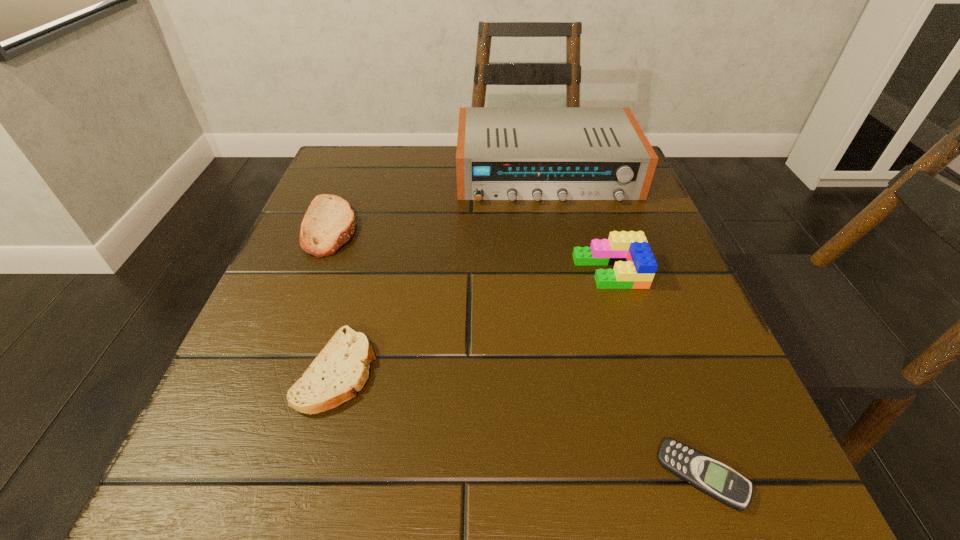
Locate an element on the screen. free area in between the Lego and the farther pita bread is located at coordinates (470, 249).

Identify the location of free spot between the radio receiver and the beeper. (624, 325).

Identify the location of free space between the fourth tallest object and the radio receiver. (442, 272).

What are the coordinates of `vacant space that's between the Lego and the nearest object` in the screenshot? It's located at (656, 374).

Find the location of a particular element. The image size is (960, 540). free space between the second shortest object and the radio receiver is located at coordinates (442, 272).

Find the location of a particular element. The image size is (960, 540). free space between the Lego and the beeper is located at coordinates (656, 374).

Find the location of a particular element. free space between the fourth shortest object and the fourth farthest object is located at coordinates (473, 321).

Identify which object is located as the second nearest to the taller pita bread. Please provide its 2D coordinates. Your answer should be formatted as a tuple, i.e. [(x, y)], where the tuple contains the x and y coordinates of a point satisfying the conditions above.

[(503, 153)]

The image size is (960, 540). In order to click on object that is the third closest to the nearest object in this screenshot , I will do `click(503, 153)`.

You are a GUI agent. You are given a task and a screenshot of the screen. Output one action in this format:
    pyautogui.click(x=<x>, y=<y>)
    Task: Click on the vacant space that satisfies the following two spatial constraints: 1. on the front side of the third shortest object; 2. on the right side of the beeper
    The width and height of the screenshot is (960, 540).
    Given the screenshot: What is the action you would take?
    point(232,476)